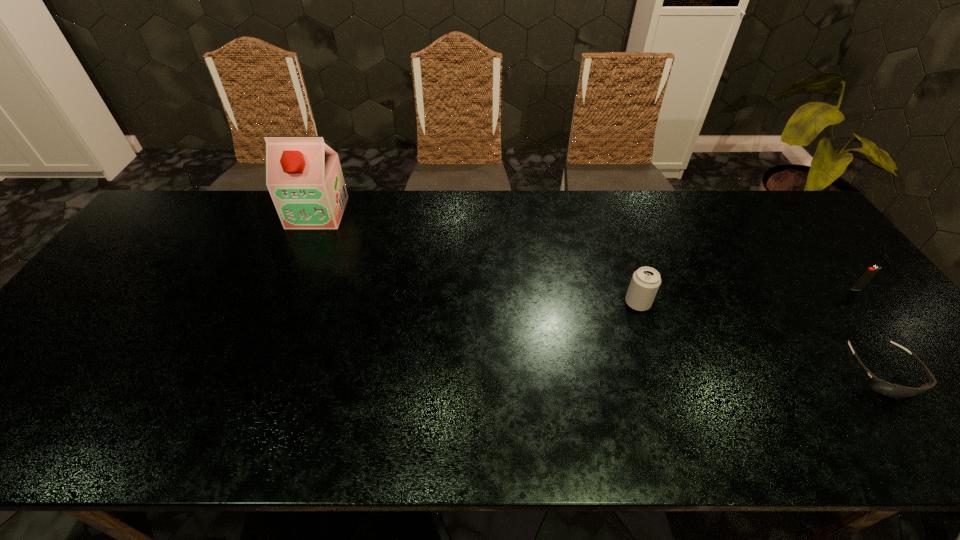
You are a GUI agent. You are given a task and a screenshot of the screen. Output one action in this format:
    pyautogui.click(x=<x>, y=<y>)
    Task: Click on the free space between the leftmost object and the second object from right to left
    
    Given the screenshot: What is the action you would take?
    pyautogui.click(x=600, y=293)

Locate an element on the screen. free area in between the tallest object and the third tallest object is located at coordinates [x=588, y=251].

Locate an element on the screen. This screenshot has height=540, width=960. vacant area that lies between the second farthest object and the second tallest object is located at coordinates 747,296.

Locate an element on the screen. The image size is (960, 540). free spot between the nearest object and the igniter is located at coordinates (870, 330).

This screenshot has width=960, height=540. In order to click on vacant region between the third shortest object and the third nearest object in this screenshot , I will do `click(747, 296)`.

You are a GUI agent. You are given a task and a screenshot of the screen. Output one action in this format:
    pyautogui.click(x=<x>, y=<y>)
    Task: Click on the free space between the soya milk and the third object from left to right
    
    Given the screenshot: What is the action you would take?
    tap(600, 293)

Image resolution: width=960 pixels, height=540 pixels. Identify the location of free area in between the igniter and the can. (747, 296).

Find the location of `vacant space in between the nearest object and the can`. vacant space in between the nearest object and the can is located at coordinates (760, 338).

Locate an element on the screen. The height and width of the screenshot is (540, 960). object that ranks as the third closest to the shortest object is located at coordinates (303, 175).

Identify which object is located as the second nearest to the soya milk. Please provide its 2D coordinates. Your answer should be formatted as a tuple, i.e. [(x, y)], where the tuple contains the x and y coordinates of a point satisfying the conditions above.

[(892, 390)]